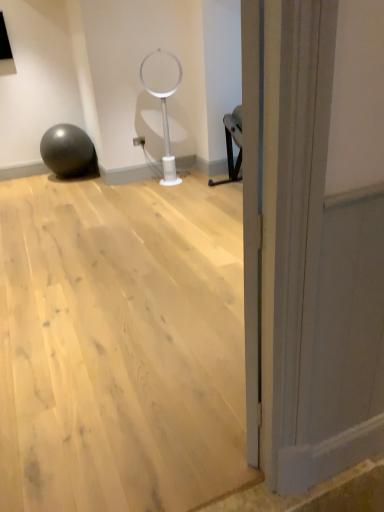
This screenshot has width=384, height=512. What do you see at coordinates (68, 151) in the screenshot?
I see `matte black ball at left` at bounding box center [68, 151].

Where is `matte black ball at left`? The width and height of the screenshot is (384, 512). matte black ball at left is located at coordinates (68, 151).

Identify the location of matte black ball at left. The image size is (384, 512). (68, 151).